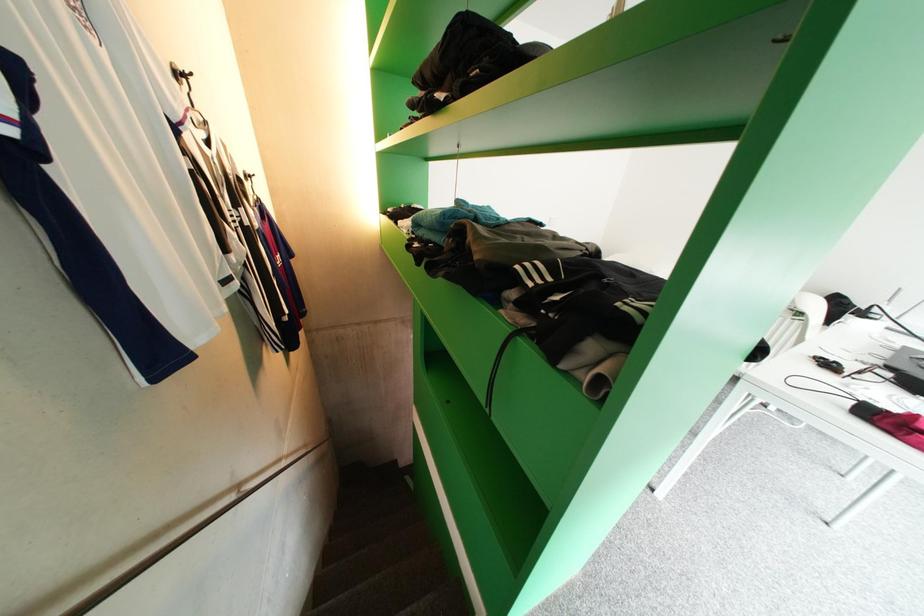
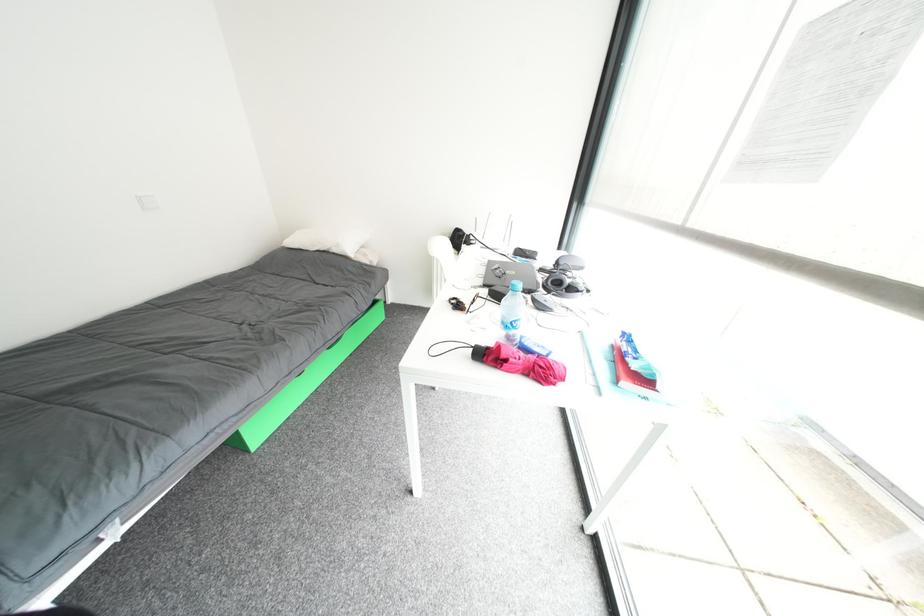
First-person continuous shooting, in which direction is the camera rotating?

The camera rotated toward right-down.